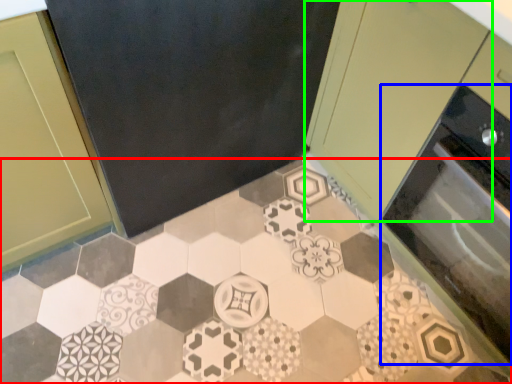
Question: Which is farther away from ceramic tile (highlighted by a red box)? oven (highlighted by a blue box) or cabinetry (highlighted by a green box)?

Choices:
 (A) oven
 (B) cabinetry

Answer: (B)